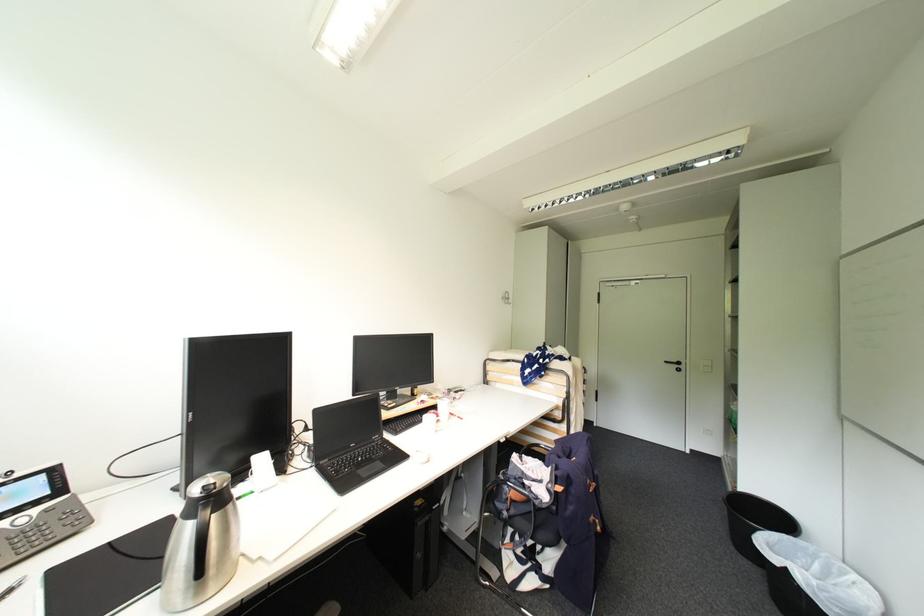
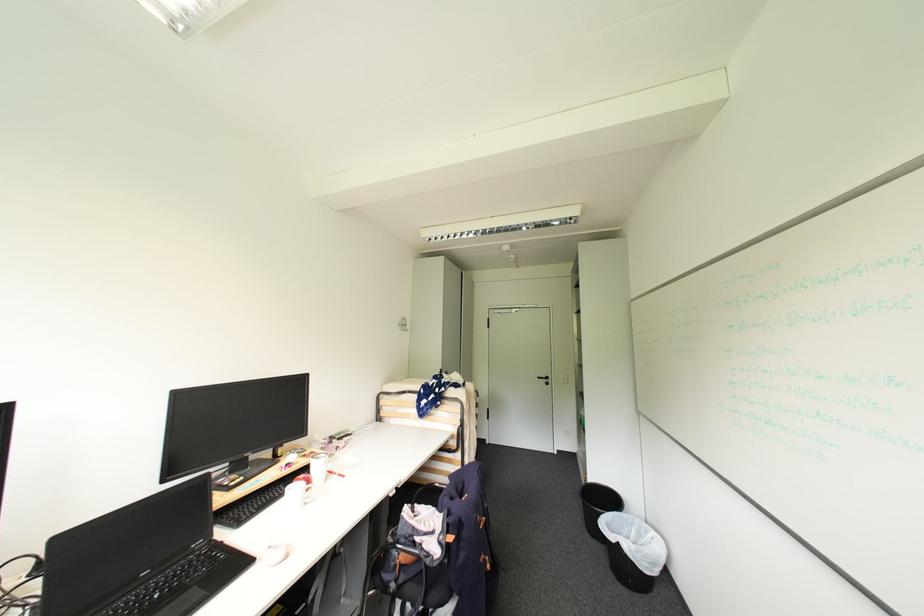
The point at (525, 455) is marked in the first image. Where is the corresponding point in the second image?

(417, 506)